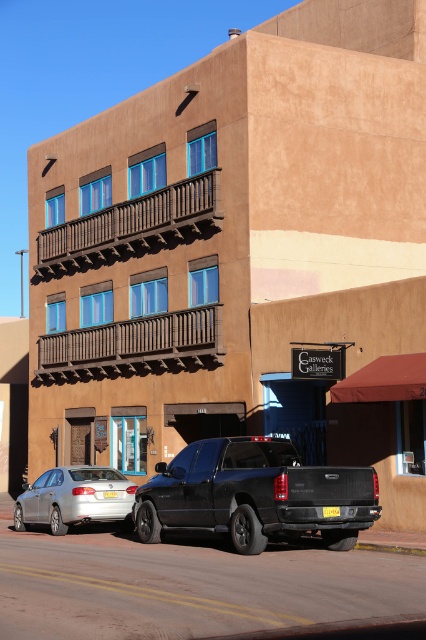
Is yellow matte license plate at center to the left of yellow plastic license plate at center from the viewer's perspective?

In fact, yellow matte license plate at center is to the right of yellow plastic license plate at center.

Which is more to the right, yellow matte license plate at center or yellow plastic license plate at center?

yellow matte license plate at center is more to the right.

Who is more distant from viewer, (333, 509) or (108, 490)?

The point (108, 490) is behind.

Where is `yellow matte license plate at center`? yellow matte license plate at center is located at coordinates (331, 512).

Does black matte truck at lower center have a greater width compared to yellow matte license plate at center?

Yes.

Between black matte truck at lower center and yellow matte license plate at center, which one has less height?

yellow matte license plate at center

Is point (149, 525) closer to viewer compared to point (336, 508)?

No, (149, 525) is further to viewer.

Identify the location of black matte truck at lower center. (255, 493).

Who is shorter, black matte truck at lower center or silver metallic sedan at lower left?

With less height is silver metallic sedan at lower left.

At what (x,y) coordinates should I click in order to perform the action: click on black matte truck at lower center. Please return your answer as a coordinate pair (x, y). Looking at the image, I should click on (255, 493).

You are a GUI agent. You are given a task and a screenshot of the screen. Output one action in this format:
    pyautogui.click(x=<x>, y=<y>)
    Task: Click on the black matte truck at lower center
    This screenshot has width=426, height=640.
    Given the screenshot: What is the action you would take?
    pyautogui.click(x=255, y=493)